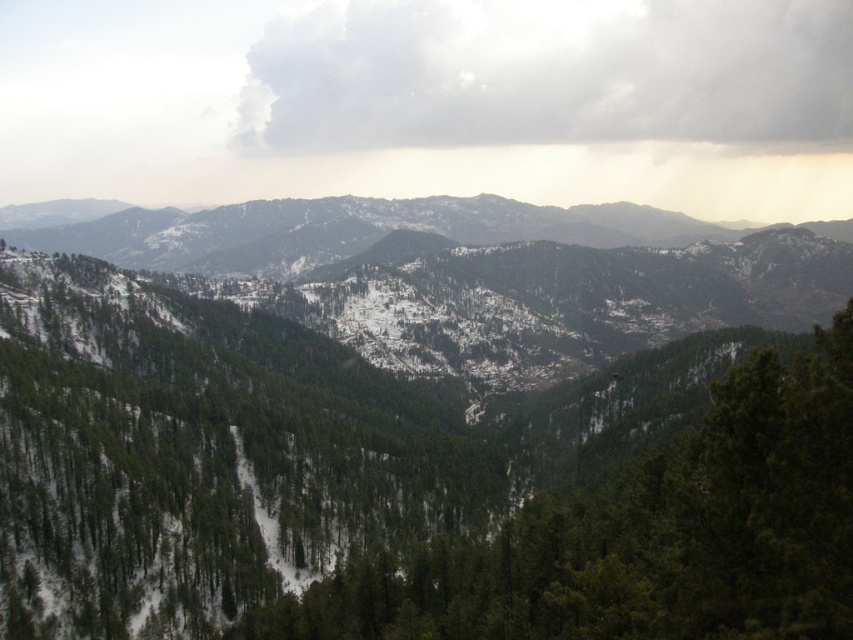
Question: Among these points, which one is farthest from the camera?

Choices:
 (A) (445, 216)
 (B) (807, 371)
 (C) (729, 1)

Answer: (C)

Question: Considering the relative positions of green matte tree at center and white fluffy cloud at upper center in the image provided, where is green matte tree at center located with respect to white fluffy cloud at upper center?

Choices:
 (A) right
 (B) left

Answer: (B)

Question: Considering the relative positions of green matte tree at center and white fluffy cloud at upper center in the image provided, where is green matte tree at center located with respect to white fluffy cloud at upper center?

Choices:
 (A) below
 (B) above

Answer: (A)

Question: Which point is closer to the camera taking this photo?

Choices:
 (A) coord(724,396)
 (B) coord(498,138)
 (C) coord(492,218)

Answer: (A)

Question: Is green matte tree at center smaller than white fluffy cloud at upper center?

Choices:
 (A) no
 (B) yes

Answer: (B)

Question: Which point is farther to the camera?

Choices:
 (A) (612, 230)
 (B) (608, 45)

Answer: (B)